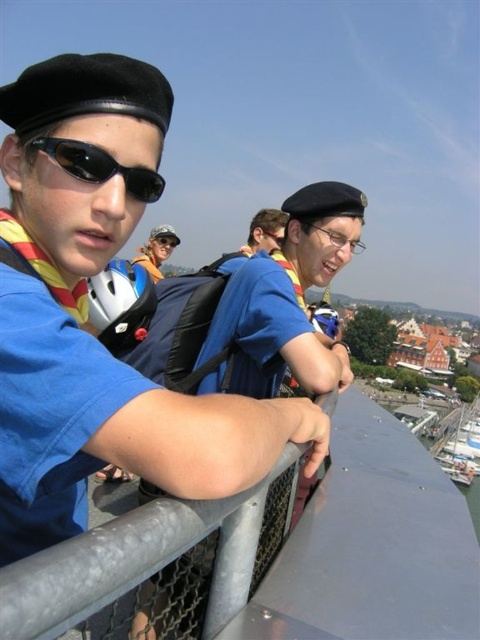
You are a photographer trying to capture both the matte blue shirt at center and the light blue shirt at center in a single frame. Based on their widths, which one should you focus on to ensure both fit in the photo?

The matte blue shirt at center has a lesser width compared to the light blue shirt at center, so focusing on the light blue shirt at center would allow both to fit in the frame since it takes up more space.

You are a photographer trying to capture a clear shot of the matte blue shirt at center and the transparent plastic goggles at center. Which object should you focus on first to ensure it appears sharp in the photo?

The matte blue shirt at center is further to the viewer than the transparent plastic goggles at center, so you should focus on the matte blue shirt at center first to ensure it appears sharp in the photo.

Consider the image. You are a photographer trying to capture a clear shot of both the black matte sunglasses at left and the brushed metal goggles at center. Since you want to ensure both are visible in the frame, which object should you focus on first to account for their size difference?

You should focus on the black matte sunglasses at left first because it is larger in size than the brushed metal goggles at center, making it easier to frame properly before adjusting for the smaller object.